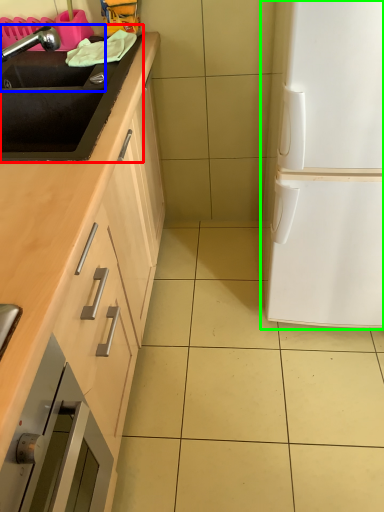
Question: Which is farther away from sink (highlighted by a red box)? sink (highlighted by a blue box) or fridge (highlighted by a green box)?

Choices:
 (A) sink
 (B) fridge

Answer: (B)